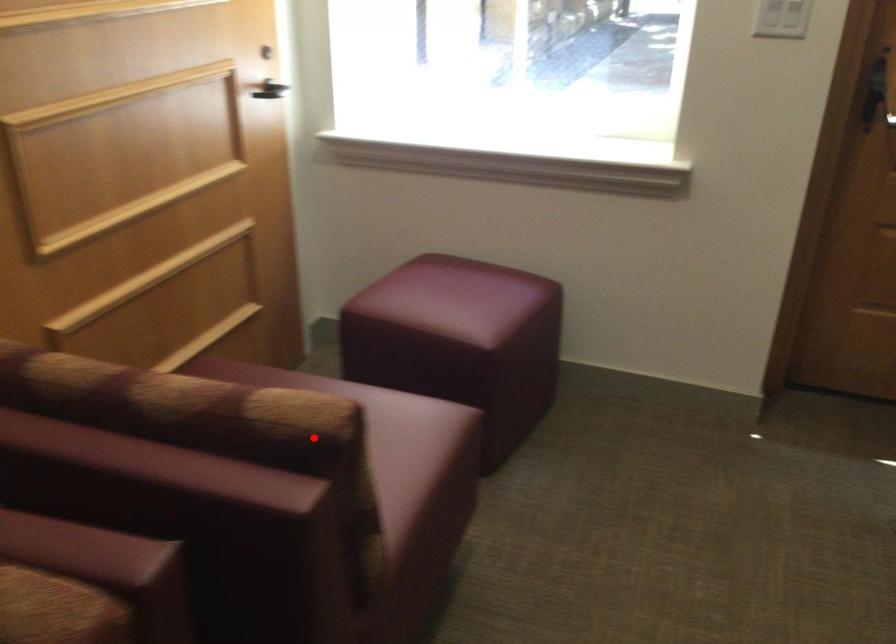
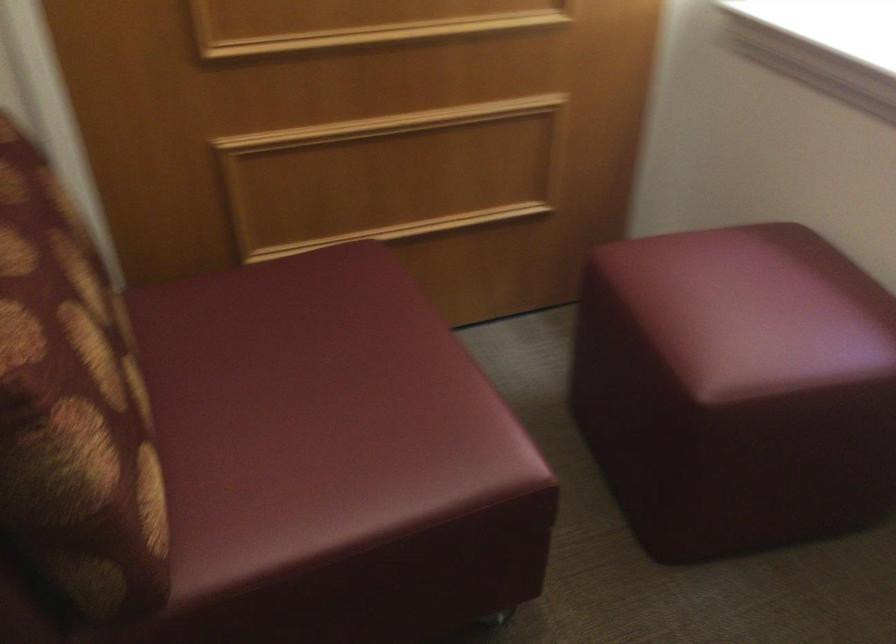
Question: A red point is marked in image1. In image2, is the corresponding 3D point closer to the camera or farther? Reply with the corresponding letter.

Choices:
 (A) The corresponding 3D point is closer.
 (B) The corresponding 3D point is farther.

Answer: (A)